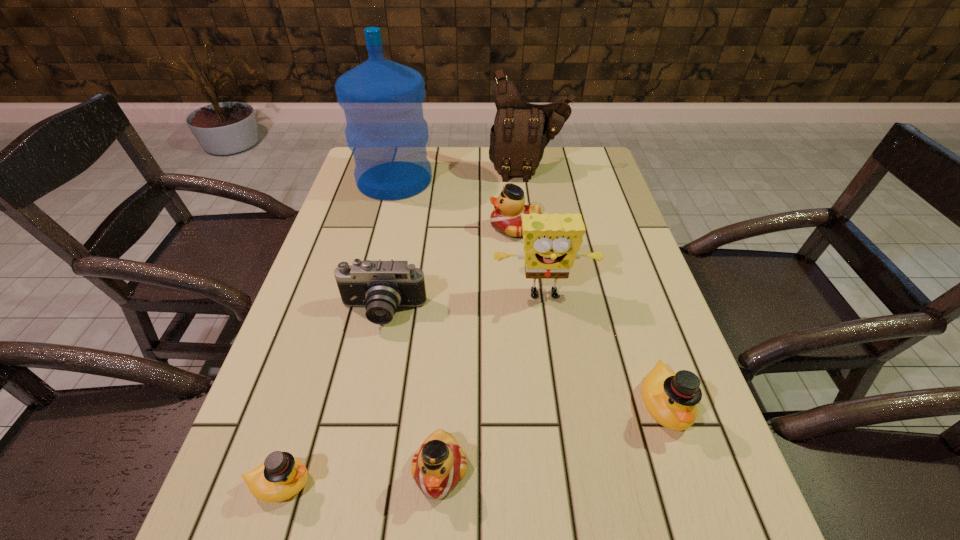
Find the location of a particular element. Image resolution: width=960 pixels, height=540 pixels. the right yellow duck is located at coordinates (671, 398).

This screenshot has width=960, height=540. In order to click on the fifth object from right to left in this screenshot , I will do `click(439, 464)`.

At what (x,y) coordinates should I click in order to perform the action: click on the smaller red duck. Please return your answer as a coordinate pair (x, y). This screenshot has height=540, width=960. Looking at the image, I should click on (439, 464).

At what (x,y) coordinates should I click in order to perform the action: click on the nearer yellow duck. Please return your answer as a coordinate pair (x, y). This screenshot has height=540, width=960. Looking at the image, I should click on (281, 476).

Locate an element on the screen. the leftmost duck is located at coordinates (281, 476).

Find the location of a particular element. The image size is (960, 540). vacant space located 0.080m on the right of the tallest object is located at coordinates (458, 180).

In order to click on vacant space positioned on the front-facing side of the second tallest object in this screenshot , I will do `click(532, 194)`.

The image size is (960, 540). Identify the location of vacant space located 0.120m on the front-facing side of the sponge. pos(553,354).

Locate an element on the screen. vacant area situated on the face of the sixth nearest object is located at coordinates (471, 228).

This screenshot has width=960, height=540. What are the coordinates of `vacant space located on the face of the sixth nearest object` in the screenshot? It's located at (428, 228).